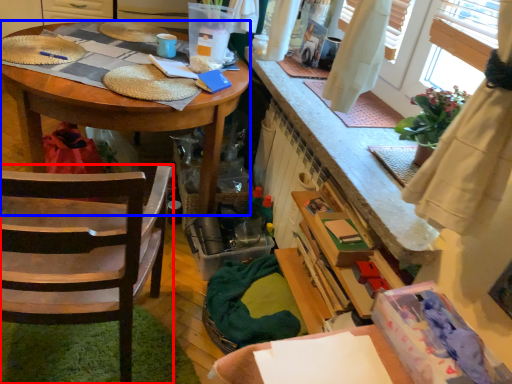
Question: Which of the following is the closest to the observer, chair (highlighted by a red box) or desk (highlighted by a blue box)?

Choices:
 (A) chair
 (B) desk

Answer: (A)